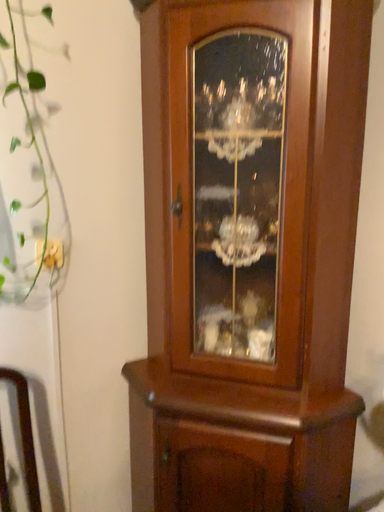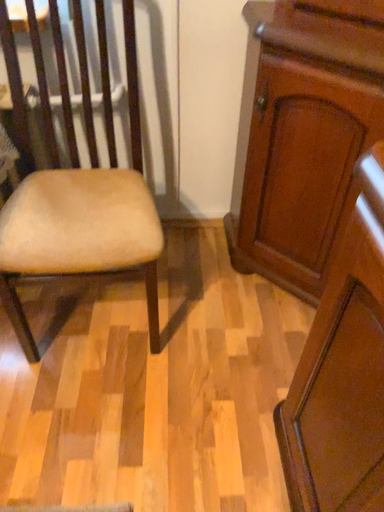
Question: How did the camera likely rotate when shooting the video?

Choices:
 (A) rotated left
 (B) rotated right

Answer: (A)